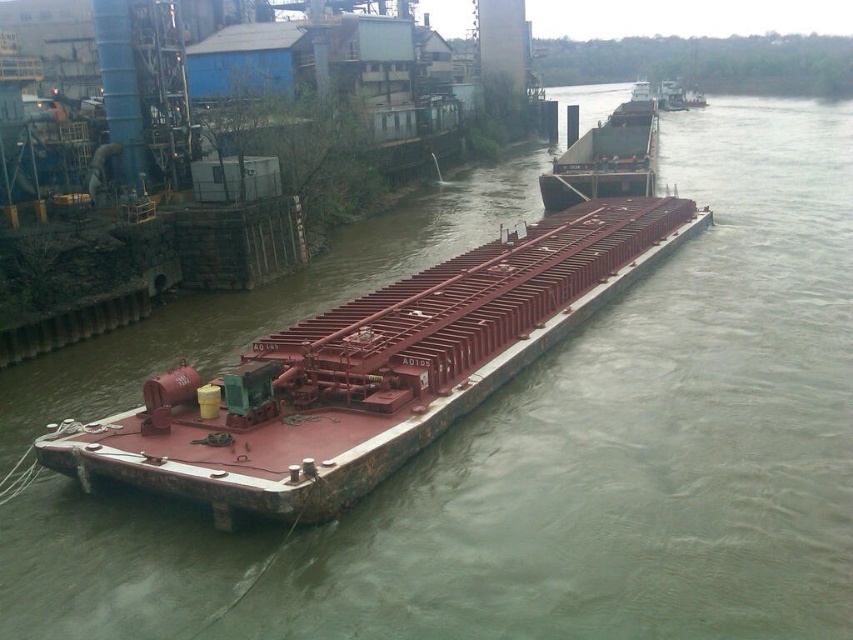
Which is more to the left, rusty metal barge at center or rustic metal barge at center?

From the viewer's perspective, rusty metal barge at center appears more on the left side.

Can you confirm if rusty metal barge at center is bigger than rustic metal barge at center?

Incorrect, rusty metal barge at center is not larger than rustic metal barge at center.

Find the location of a particular element. The width and height of the screenshot is (853, 640). rusty metal barge at center is located at coordinates (370, 371).